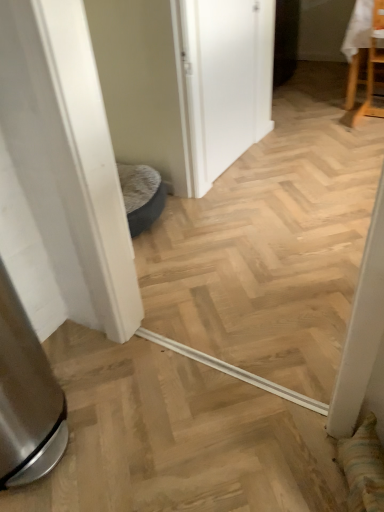
At what (x,y) coordinates should I click in order to perform the action: click on vacant space in between white matte door at center and wooden chair at upper right. Please return your answer as a coordinate pair (x, y). Image resolution: width=384 pixels, height=512 pixels. Looking at the image, I should click on (294, 147).